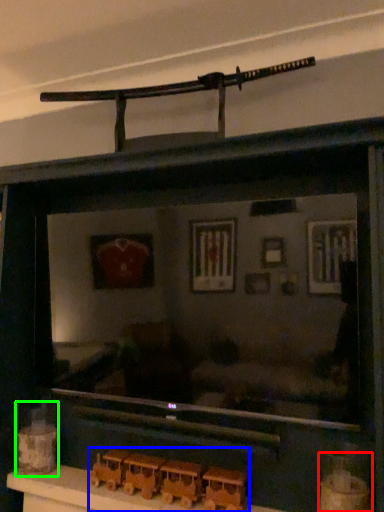
Question: Estimate the real-world distances between objects in this image. Which object is farther from toy (highlighted by a red box), toy (highlighted by a blue box) or toy (highlighted by a green box)?

Choices:
 (A) toy
 (B) toy

Answer: (B)